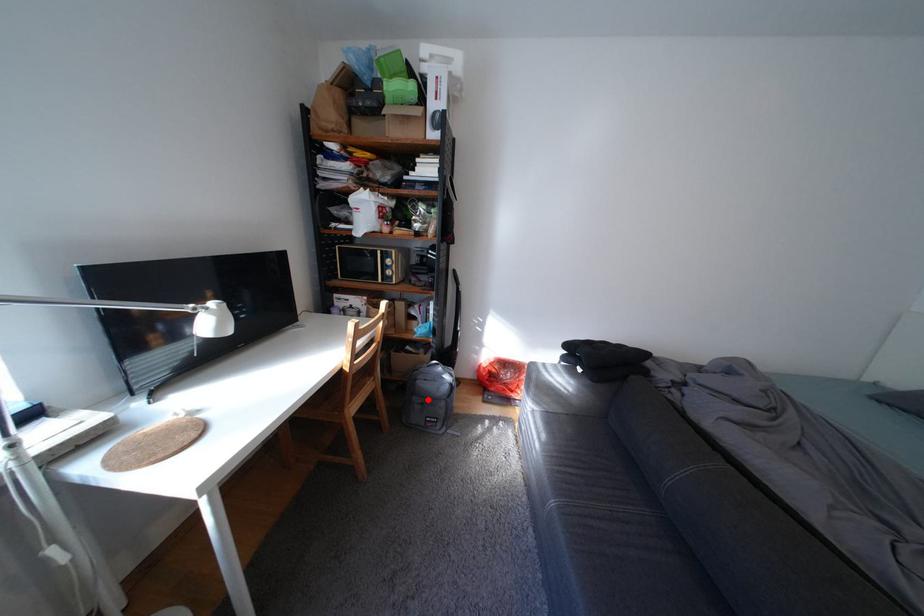
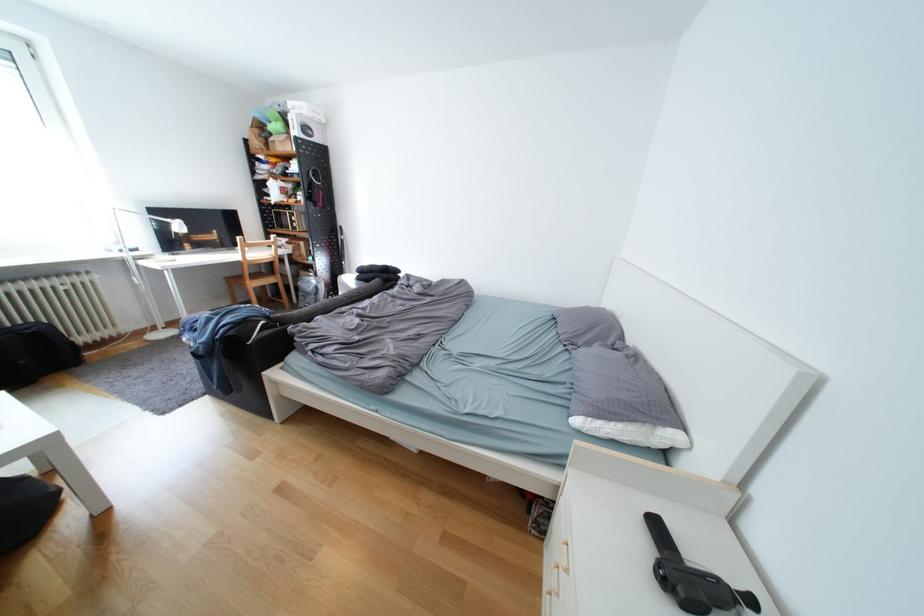
Question: A red point is marked in image1. In image2, is the corresponding 3D point closer to the camera or farther? Reply with the corresponding letter.

Choices:
 (A) The corresponding 3D point is closer.
 (B) The corresponding 3D point is farther.

Answer: (B)